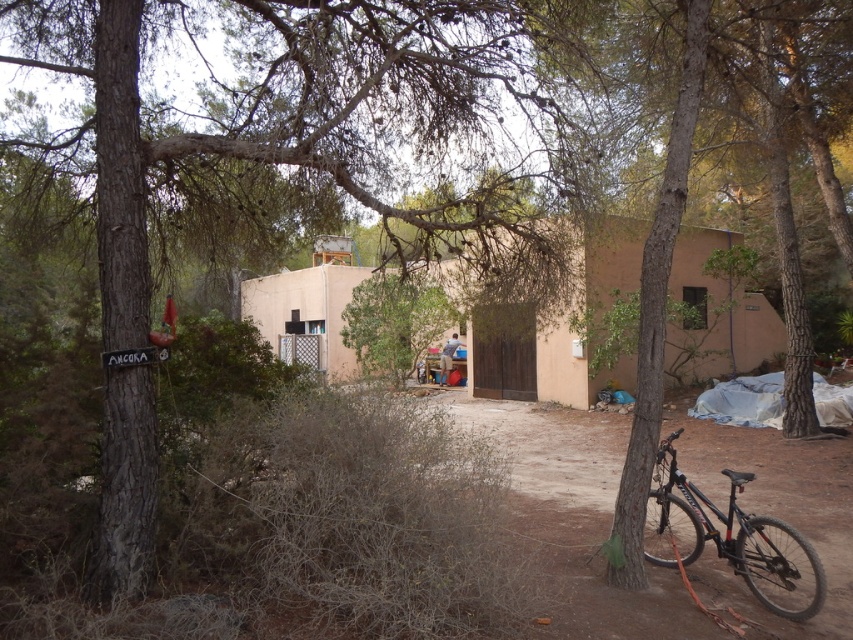
Question: Considering the real-world distances, which object is farthest from the black matte mountain bike at lower right?

Choices:
 (A) brown rough tree at left
 (B) beige stucco hut at center

Answer: (B)

Question: Which point is farther to the camera?

Choices:
 (A) (811, 556)
 (B) (534, 333)
 (C) (494, 45)

Answer: (B)

Question: Is beige stucco hut at center wider than black matte mountain bike at lower right?

Choices:
 (A) no
 (B) yes

Answer: (B)

Question: Is beige stucco hut at center wider than black matte mountain bike at lower right?

Choices:
 (A) yes
 (B) no

Answer: (A)

Question: Which is nearer to the brown rough tree at left?

Choices:
 (A) black matte mountain bike at lower right
 (B) beige stucco hut at center

Answer: (A)

Question: Can you confirm if brown rough tree at left is wider than black matte mountain bike at lower right?

Choices:
 (A) no
 (B) yes

Answer: (B)